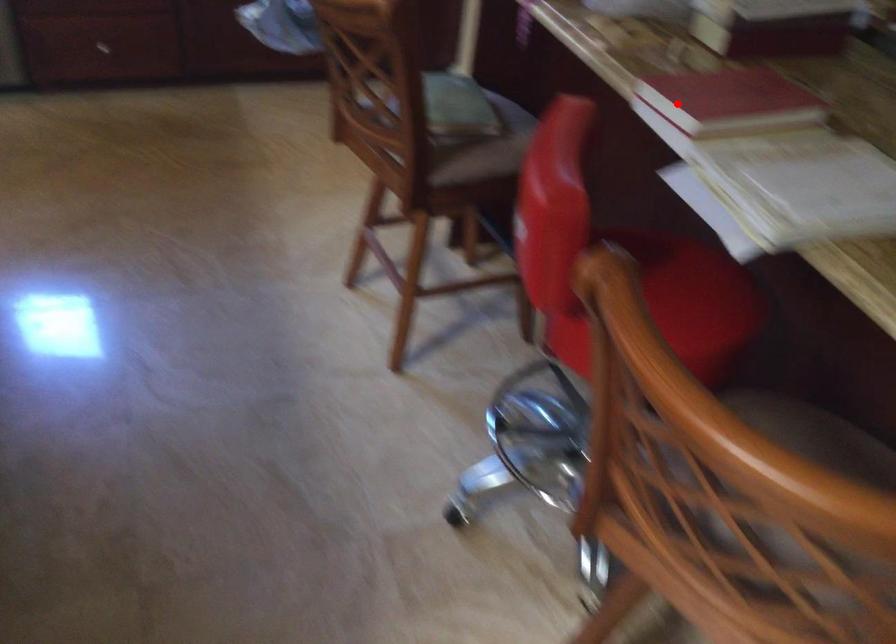
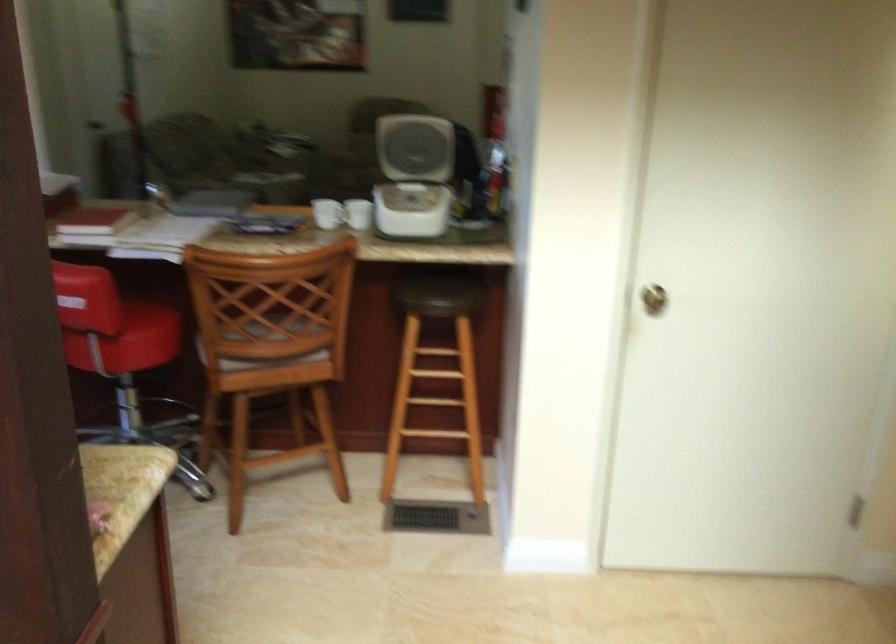
Question: I am providing you with two images of the same scene from different viewpoints. A red point is shown in image1. For the corresponding object point in image2, is it positioned nearer or farther from the camera?

Choices:
 (A) Nearer
 (B) Farther

Answer: (B)